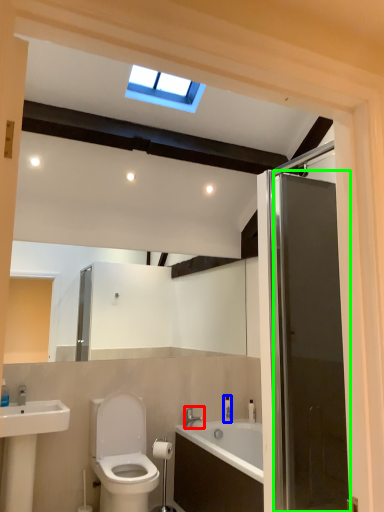
Question: Which is nearer to the tap (highlighted by a red box)? toiletry (highlighted by a blue box) or door (highlighted by a green box).

Choices:
 (A) toiletry
 (B) door

Answer: (A)